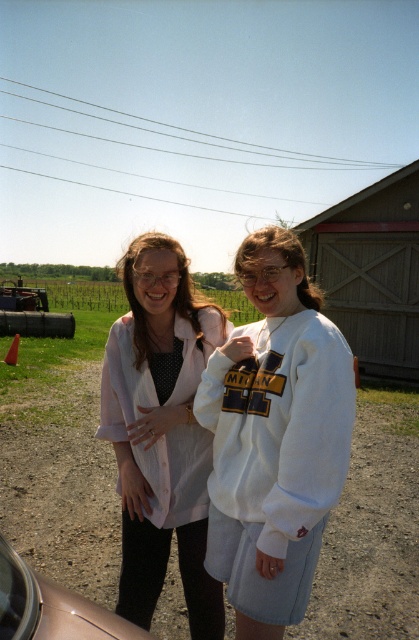
Looking at this image, you are standing at the edge of the dirt track at lower center and want to reach the white fleece sweatshirt at center. Which direction should you move to get closer to it?

The dirt track at lower center is positioned under the white fleece sweatshirt at center, so you should move upward to reach it.

You are standing at the center of the image and want to walk towards the dirt track at lower center. In which direction should you move?

Since the dirt track at lower center is located at point (62,483), you should move downward and to the right to reach it.